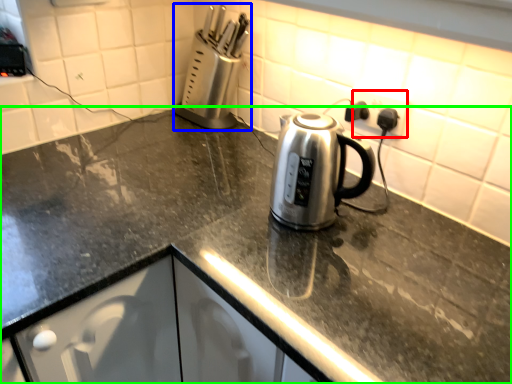
Question: Which is nearer to the electric outlet (highlighted by a red box)? appliance (highlighted by a blue box) or countertop (highlighted by a green box).

Choices:
 (A) appliance
 (B) countertop

Answer: (A)